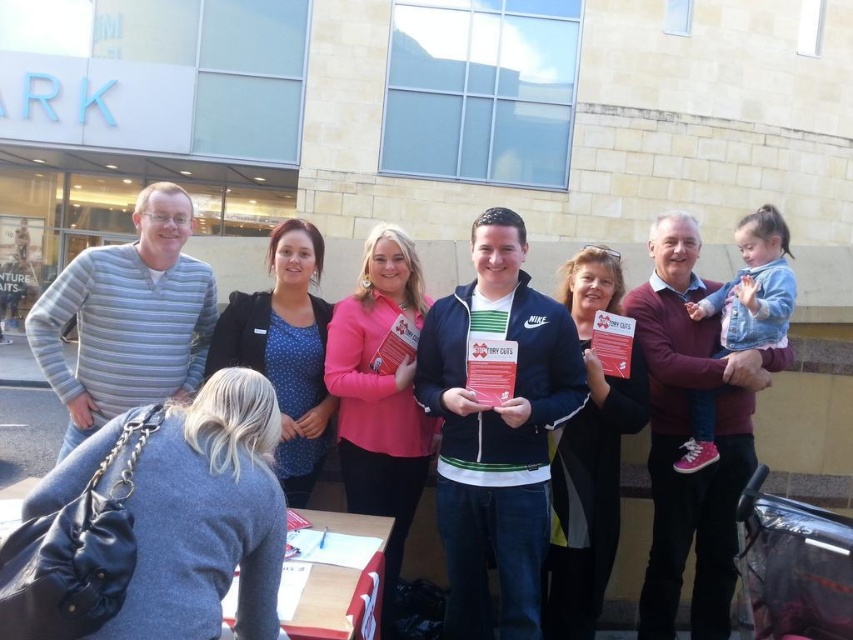
Between maroon sweater at upper right and gray striped sweater at left, which one has more height?

Standing taller between the two is maroon sweater at upper right.

The height and width of the screenshot is (640, 853). I want to click on maroon sweater at upper right, so click(x=689, y=435).

At what (x,y) coordinates should I click in order to perform the action: click on maroon sweater at upper right. Please return your answer as a coordinate pair (x, y). The height and width of the screenshot is (640, 853). Looking at the image, I should click on (689, 435).

Does point (457, 410) come in front of point (85, 282)?

Yes, point (457, 410) is in front of point (85, 282).

Is the position of striped cotton shirt at center less distant than that of gray striped sweater at left?

Yes.

Locate an element on the screen. This screenshot has height=640, width=853. striped cotton shirt at center is located at coordinates (497, 428).

Is striped cotton shirt at center above maroon sweater at upper right?

Yes.

I want to click on striped cotton shirt at center, so click(x=497, y=428).